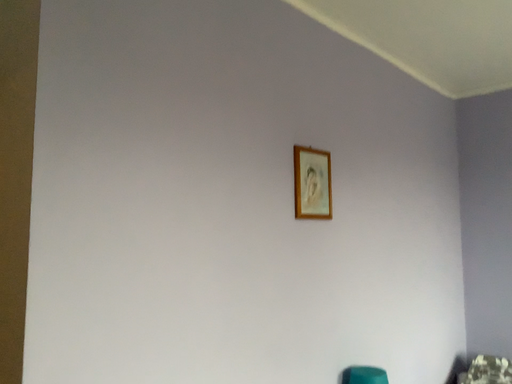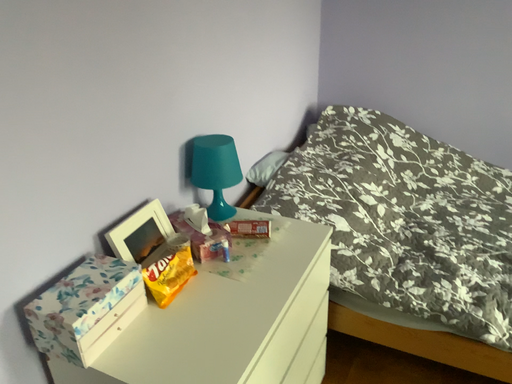
Question: Which way did the camera rotate in the video?

Choices:
 (A) rotated left
 (B) rotated right

Answer: (B)